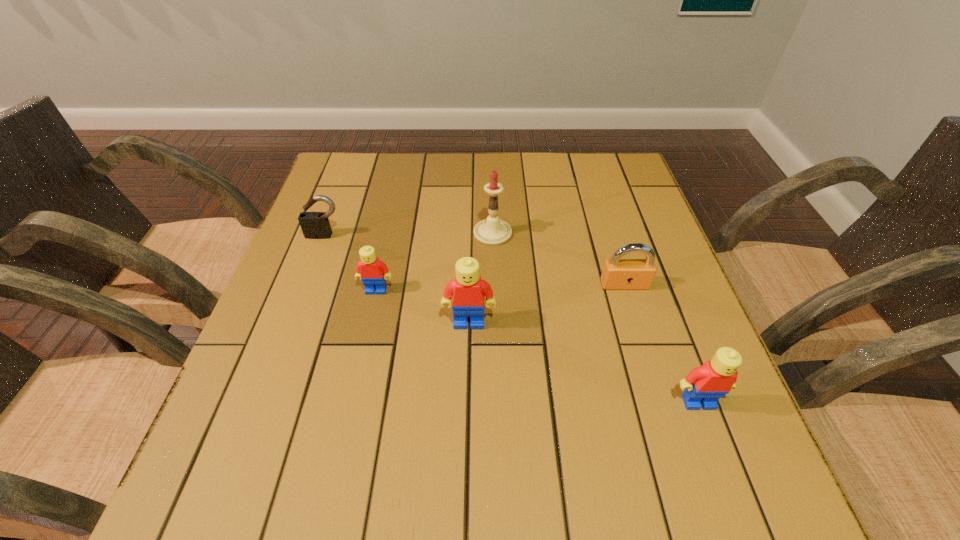
Find the location of `object located at the near right corner`. object located at the near right corner is located at coordinates (704, 385).

At what (x,y) coordinates should I click in order to perform the action: click on free space at the far edge of the desktop. Please return your answer as a coordinate pair (x, y). This screenshot has width=960, height=540. Looking at the image, I should click on coord(569,164).

Identify the location of free space at the near edge of the desktop. The width and height of the screenshot is (960, 540). (367, 404).

Where is `vacant space at the left edge`? This screenshot has width=960, height=540. vacant space at the left edge is located at coordinates (348, 248).

In the image, there is a desktop. Identify the location of vacant space at the right edge. (608, 214).

Find the location of a particular element. This screenshot has width=960, height=540. free location at the far left corner is located at coordinates point(359,183).

Image resolution: width=960 pixels, height=540 pixels. In order to click on free space at the near right corner of the desktop in this screenshot , I will do `click(688, 425)`.

The height and width of the screenshot is (540, 960). Identify the location of empty space that is in between the candle and the farthest Lego. (435, 261).

Identify the location of free spot between the candle and the left padlock. point(409,234).

Image resolution: width=960 pixels, height=540 pixels. Identify the location of vacant space that's between the farthest Lego and the leftmost object. (350, 263).